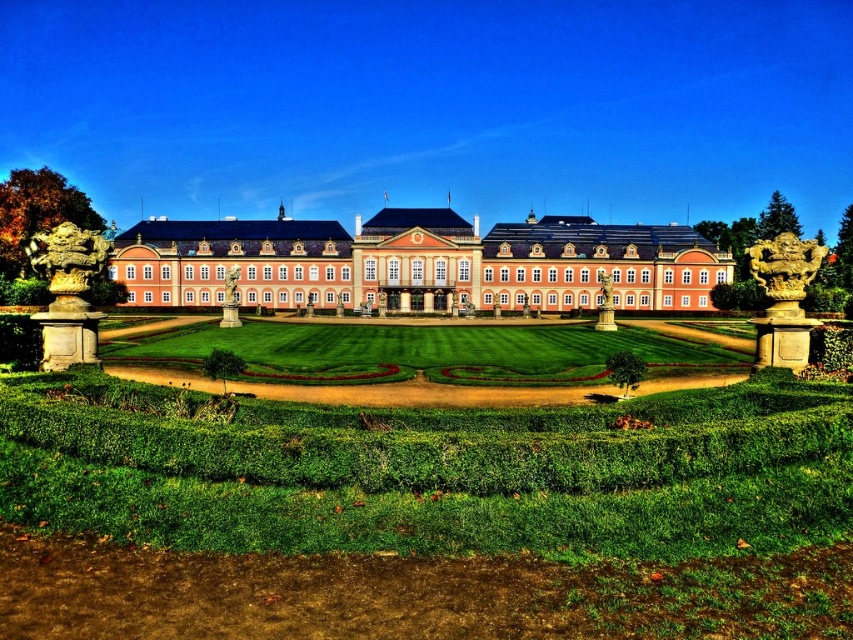
You are standing in the garden of the palace and want to walk towards the matte pink building at center. Which direction should you walk to avoid the green grass at center?

To avoid the green grass at center, you should walk around it since the green grass at center is in front of the matte pink building at center, so walking around would allow you to reach the building without stepping on the grass.

You are standing at the entrance of the palace and see two points marked in the garden. The first point is at coordinates point (637,298) and the second is at point (712,296). Which point is closer to the palace entrance?

Point (637,298) is in front of point (712,296), so it is closer to the palace entrance.

You are standing at the entrance of the palace garden and want to walk towards the matte pink building at center. There is a green leafy hedge at center in your path. Based on their widths, can you estimate if you can walk around the hedge without going off the pathway?

The matte pink building at center might be wider than green leafy hedge at center, so it is possible that the pathway between them allows you to walk around the hedge without leaving the path.